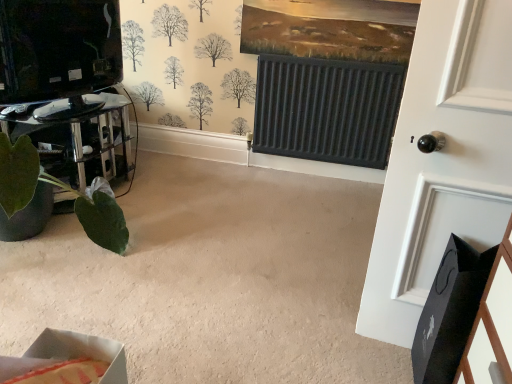
Question: Is green matte plant pot at lower left positioned far away from cardboard box at lower left?

Choices:
 (A) yes
 (B) no

Answer: (A)

Question: Could you tell me if green matte plant pot at lower left is facing cardboard box at lower left?

Choices:
 (A) no
 (B) yes

Answer: (A)

Question: Can you confirm if green matte plant pot at lower left is shorter than cardboard box at lower left?

Choices:
 (A) yes
 (B) no

Answer: (B)

Question: Can you confirm if green matte plant pot at lower left is smaller than cardboard box at lower left?

Choices:
 (A) no
 (B) yes

Answer: (A)

Question: From a real-world perspective, is green matte plant pot at lower left physically above cardboard box at lower left?

Choices:
 (A) no
 (B) yes

Answer: (A)

Question: Considering the positions of point [x=79, y=339] and point [x=487, y=160], is point [x=79, y=339] closer or farther from the camera than point [x=487, y=160]?

Choices:
 (A) farther
 (B) closer

Answer: (B)

Question: Is cardboard box at lower left situated inside white matte door at right or outside?

Choices:
 (A) outside
 (B) inside

Answer: (A)

Question: Considering the positions of cardboard box at lower left and white matte door at right in the image, is cardboard box at lower left taller or shorter than white matte door at right?

Choices:
 (A) short
 (B) tall

Answer: (A)

Question: Based on their positions, is cardboard box at lower left located to the left or right of white matte door at right?

Choices:
 (A) left
 (B) right

Answer: (A)

Question: From their relative heights in the image, would you say cardboard box at lower left is taller or shorter than green matte plant pot at lower left?

Choices:
 (A) short
 (B) tall

Answer: (A)

Question: In the image, is cardboard box at lower left on the left side or the right side of green matte plant pot at lower left?

Choices:
 (A) left
 (B) right

Answer: (B)

Question: Is point (30, 347) positioned closer to the camera than point (117, 168)?

Choices:
 (A) farther
 (B) closer

Answer: (B)

Question: Considering their positions, is cardboard box at lower left located in front of or behind green matte plant pot at lower left?

Choices:
 (A) front
 (B) behind

Answer: (A)

Question: In terms of size, does green matte plant pot at lower left appear bigger or smaller than cardboard box at lower left?

Choices:
 (A) big
 (B) small

Answer: (A)

Question: From their relative heights in the image, would you say green matte plant pot at lower left is taller or shorter than cardboard box at lower left?

Choices:
 (A) tall
 (B) short

Answer: (A)